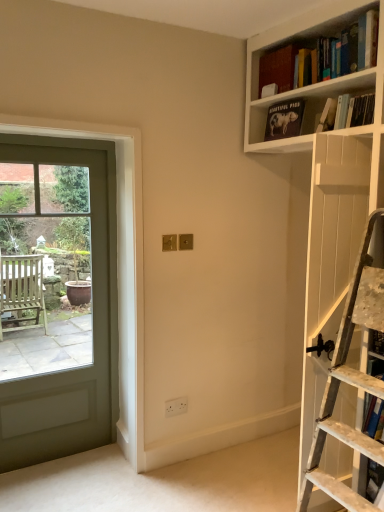
Question: From their relative heights in the image, would you say hardcover book at upper right, the fourth book when ordered from top to bottom, is taller or shorter than matte black book at upper right, acting as the 4th book starting from the bottom?

Choices:
 (A) tall
 (B) short

Answer: (B)

Question: From the image's perspective, is hardcover book at upper right, the fourth book when ordered from top to bottom, positioned above or below matte black book at upper right, acting as the 2th book starting from the top?

Choices:
 (A) above
 (B) below

Answer: (B)

Question: Estimate the real-world distances between objects in this image. Which object is closer to the hardcover book at upper right, the second book in the bottom-to-top sequence?

Choices:
 (A) blue hardcover book at right, the 1th book positioned from the bottom
 (B) matte black book at upper right, acting as the 2th book starting from the top
 (C) matte glass door at left
 (D) hardcover book at upper right, marked as the third book in a top-to-bottom arrangement
 (E) hardcover book at upper right, the fifth book in the bottom-to-top sequence

Answer: (D)

Question: Estimate the real-world distances between objects in this image. Which object is farther from the hardcover book at upper right, the fifth book in the bottom-to-top sequence?

Choices:
 (A) hardcover book at upper right, which is the third book from bottom to top
 (B) hardcover book at upper right, the second book in the bottom-to-top sequence
 (C) blue hardcover book at right, the 1th book positioned from the bottom
 (D) matte glass door at left
 (E) matte black book at upper right, acting as the 2th book starting from the top

Answer: (D)